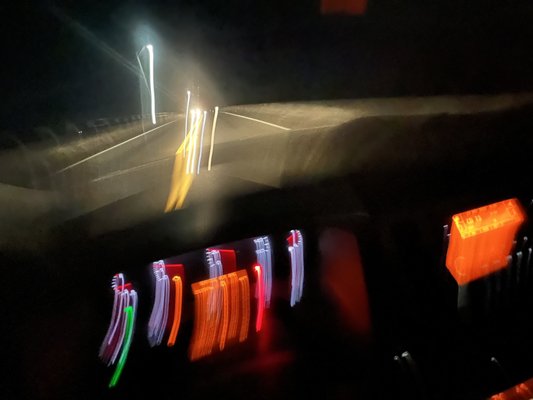
You are a GUI agent. You are given a task and a screenshot of the screen. Output one action in this format:
    pyautogui.click(x=<x>, y=<y>)
    Task: Click on the divider
    This screenshot has height=400, width=533.
    Given the screenshot: What is the action you would take?
    pyautogui.click(x=93, y=140)